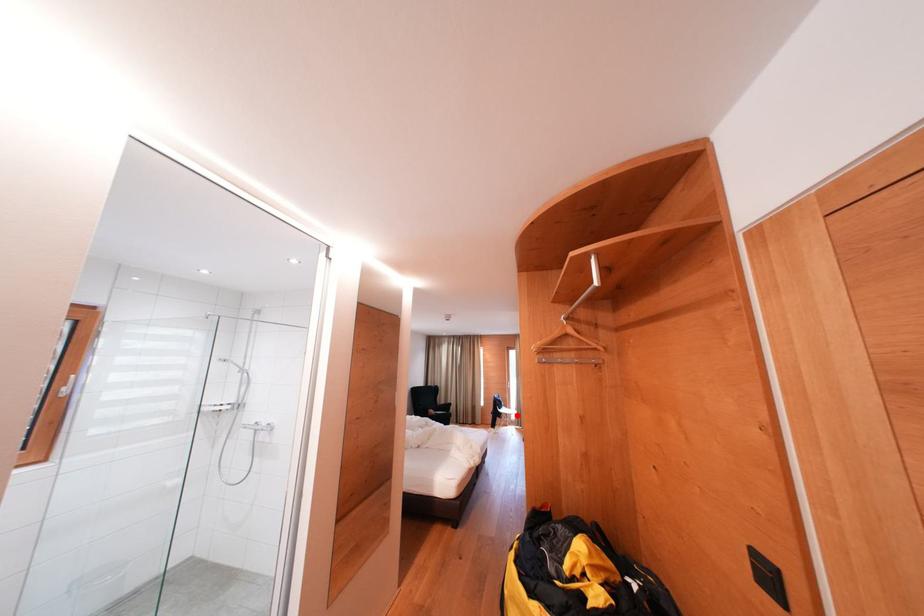
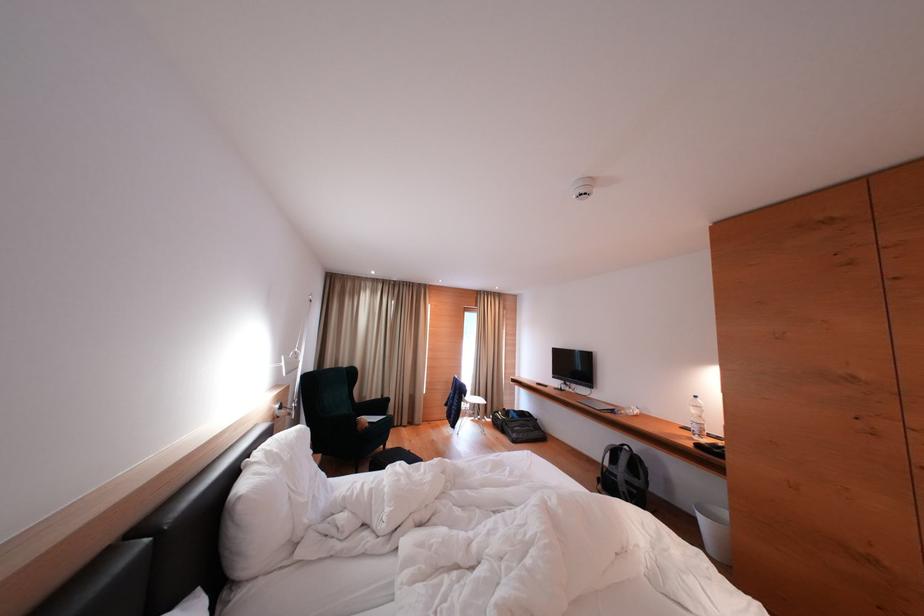
Question: I am providing you with two images of the same scene from different viewpoints. In image1, a red point is highlighted. Considering the same 3D point in image2, which of the following is correct?

Choices:
 (A) It is closer
 (B) It is farther

Answer: (A)